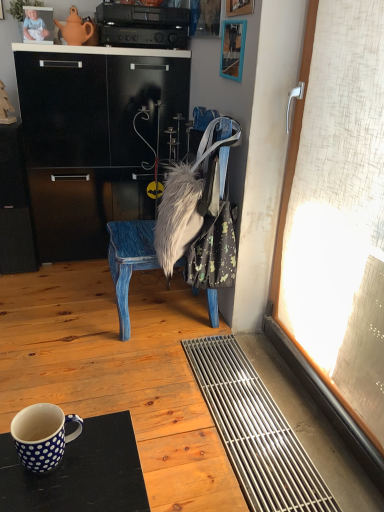
Question: Is wooden picture frame at upper center, the 1th picture frame when ordered from front to back, shorter than wooden picture frame at upper right, the 2th picture frame from the left?

Choices:
 (A) no
 (B) yes

Answer: (A)

Question: Does wooden picture frame at upper center, the first picture frame in the right-to-left sequence, have a larger size compared to wooden picture frame at upper right, the first picture frame when ordered from bottom to top?

Choices:
 (A) no
 (B) yes

Answer: (B)

Question: Does wooden picture frame at upper center, the first picture frame in the right-to-left sequence, have a greater width compared to wooden picture frame at upper right, the first picture frame when ordered from bottom to top?

Choices:
 (A) yes
 (B) no

Answer: (B)

Question: Is wooden picture frame at upper center, the 1th picture frame when ordered from front to back, positioned behind wooden picture frame at upper right, the first picture frame when ordered from bottom to top?

Choices:
 (A) yes
 (B) no

Answer: (B)

Question: From the image's perspective, is wooden picture frame at upper center, which is the third picture frame from back to front, under wooden picture frame at upper right, arranged as the 2th picture frame when viewed from the right?

Choices:
 (A) no
 (B) yes

Answer: (A)

Question: Could you tell me if wooden picture frame at upper center, the 2th picture frame from the top, is facing wooden picture frame at upper right, placed as the second picture frame when sorted from back to front?

Choices:
 (A) no
 (B) yes

Answer: (A)

Question: From the image's perspective, is brushed metal picture frame at upper center, the 1th picture frame from the back, below white polka dot ceramic mug at lower left?

Choices:
 (A) no
 (B) yes

Answer: (A)

Question: Does brushed metal picture frame at upper center, which ranks as the 1th picture frame in top-to-bottom order, have a greater height compared to white polka dot ceramic mug at lower left?

Choices:
 (A) no
 (B) yes

Answer: (B)

Question: From a real-world perspective, is brushed metal picture frame at upper center, the 3th picture frame in the right-to-left sequence, on white polka dot ceramic mug at lower left?

Choices:
 (A) no
 (B) yes

Answer: (B)

Question: Is brushed metal picture frame at upper center, the 3th picture frame in the right-to-left sequence, behind white polka dot ceramic mug at lower left?

Choices:
 (A) yes
 (B) no

Answer: (A)

Question: Can you confirm if brushed metal picture frame at upper center, positioned as the 3th picture frame in bottom-to-top order, is wider than white polka dot ceramic mug at lower left?

Choices:
 (A) no
 (B) yes

Answer: (A)

Question: From the image's perspective, is brushed metal picture frame at upper center, the first picture frame in the left-to-right sequence, located above white polka dot ceramic mug at lower left?

Choices:
 (A) yes
 (B) no

Answer: (A)

Question: Would you consider fuzzy fabric bag at center to be distant from brushed metal picture frame at upper center, positioned as the 3th picture frame in bottom-to-top order?

Choices:
 (A) no
 (B) yes

Answer: (B)